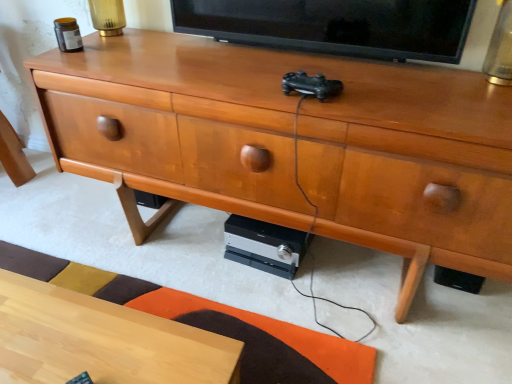
Image resolution: width=512 pixels, height=384 pixels. Identify the location of vacant area situated below wooden chest of drawers at center (from a real-world perspective). (309, 283).